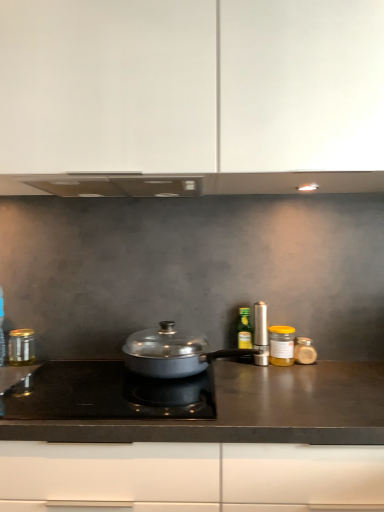
Find the location of a particular element. This screenshot has height=512, width=384. free space to the left of silver metallic salt shaker at right, which is counted as the fourth kitchen appliance, starting from the left is located at coordinates (227, 368).